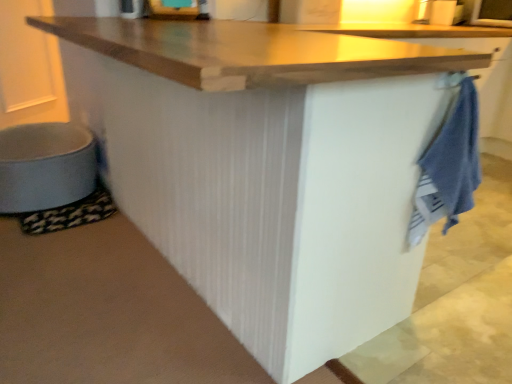
Question: From a real-world perspective, is matte gray step stool at lower left physically below blue cotton towel at right?

Choices:
 (A) no
 (B) yes

Answer: (B)

Question: Is matte gray step stool at lower left not near blue cotton towel at right?

Choices:
 (A) yes
 (B) no

Answer: (A)

Question: Is matte gray step stool at lower left in front of blue cotton towel at right?

Choices:
 (A) no
 (B) yes

Answer: (A)

Question: Considering the relative sizes of matte gray step stool at lower left and blue cotton towel at right in the image provided, is matte gray step stool at lower left thinner than blue cotton towel at right?

Choices:
 (A) yes
 (B) no

Answer: (B)

Question: Is matte gray step stool at lower left positioned behind blue cotton towel at right?

Choices:
 (A) no
 (B) yes

Answer: (B)

Question: Is matte gray step stool at lower left at the left side of blue cotton towel at right?

Choices:
 (A) no
 (B) yes

Answer: (B)

Question: Can you confirm if blue cotton towel at right is wider than matte gray step stool at lower left?

Choices:
 (A) yes
 (B) no

Answer: (B)

Question: Is there a large distance between blue cotton towel at right and matte gray step stool at lower left?

Choices:
 (A) no
 (B) yes

Answer: (B)

Question: Is blue cotton towel at right oriented towards matte gray step stool at lower left?

Choices:
 (A) no
 (B) yes

Answer: (A)

Question: Is blue cotton towel at right bigger than matte gray step stool at lower left?

Choices:
 (A) yes
 (B) no

Answer: (B)

Question: Does blue cotton towel at right have a smaller size compared to matte gray step stool at lower left?

Choices:
 (A) no
 (B) yes

Answer: (B)

Question: Would you say blue cotton towel at right contains matte gray step stool at lower left?

Choices:
 (A) yes
 (B) no

Answer: (B)

Question: Based on their sizes in the image, would you say blue cotton towel at right is bigger or smaller than matte gray step stool at lower left?

Choices:
 (A) big
 (B) small

Answer: (B)